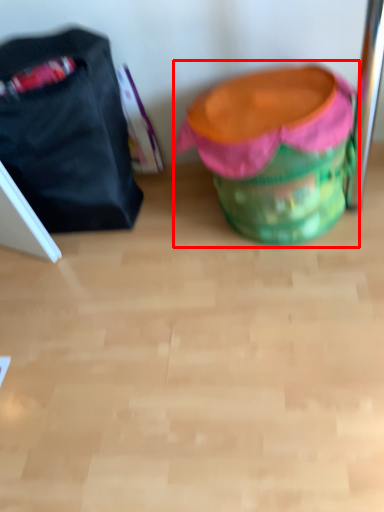
Question: From the image's perspective, what is the correct spatial relationship of bean bag chair (annotated by the red box) in relation to luggage and bags?

Choices:
 (A) above
 (B) below

Answer: (B)